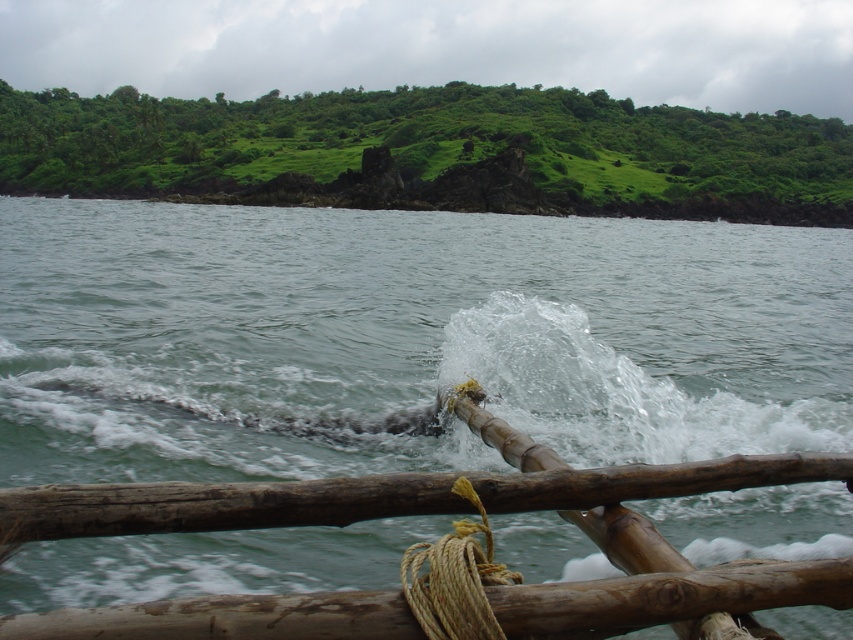
You are a marine biologist observing the scene. You notice the greenish water at center and the natural tan rope at lower center. Which object occupies a bigger area in the image?

The greenish water at center has a larger size compared to the natural tan rope at lower center, so it occupies a bigger area in the image.